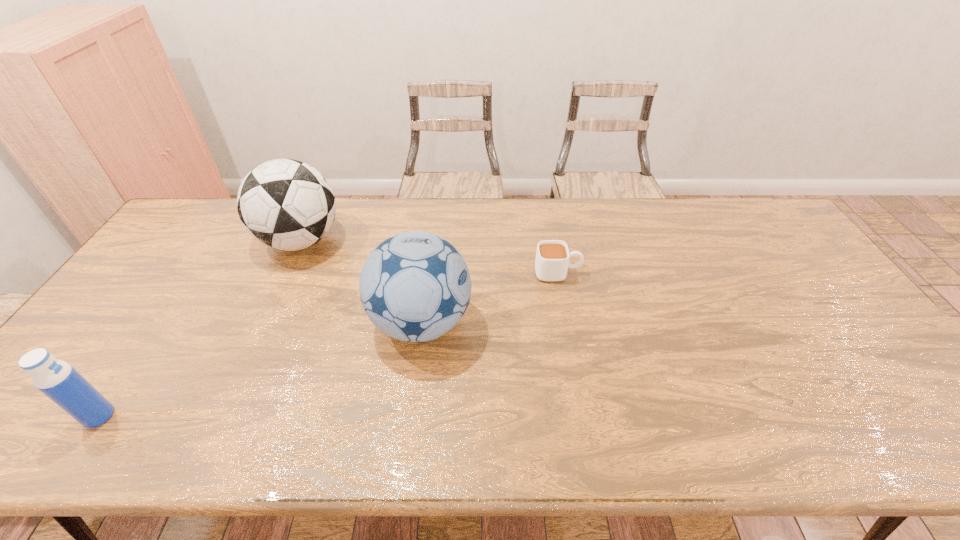
This screenshot has width=960, height=540. Find the location of `free spot located 0.210m on the back of the leftmost object`. free spot located 0.210m on the back of the leftmost object is located at coordinates (x=156, y=333).

The image size is (960, 540). I want to click on vacant space located 0.100m on the side with the handle of the rightmost object, so click(613, 273).

You are a GUI agent. You are given a task and a screenshot of the screen. Output one action in this format:
    pyautogui.click(x=<x>, y=<y>)
    Task: Click on the object that is at the far edge
    Image resolution: width=960 pixels, height=540 pixels.
    Given the screenshot: What is the action you would take?
    (x=285, y=204)

Where is `object that is at the near edge`? object that is at the near edge is located at coordinates (58, 380).

Find the location of a particular element. object that is at the left edge is located at coordinates (58, 380).

Locate an element on the screen. The width and height of the screenshot is (960, 540). object present at the near left corner is located at coordinates (58, 380).

Locate an element on the screen. blank space at the far edge is located at coordinates (502, 201).

The image size is (960, 540). Find the location of `vacant space at the near edge of the desktop`. vacant space at the near edge of the desktop is located at coordinates (511, 434).

Locate an element on the screen. free space at the left edge of the desktop is located at coordinates (56, 407).

Locate an element on the screen. The image size is (960, 540). vacant space at the near right corner is located at coordinates click(939, 454).